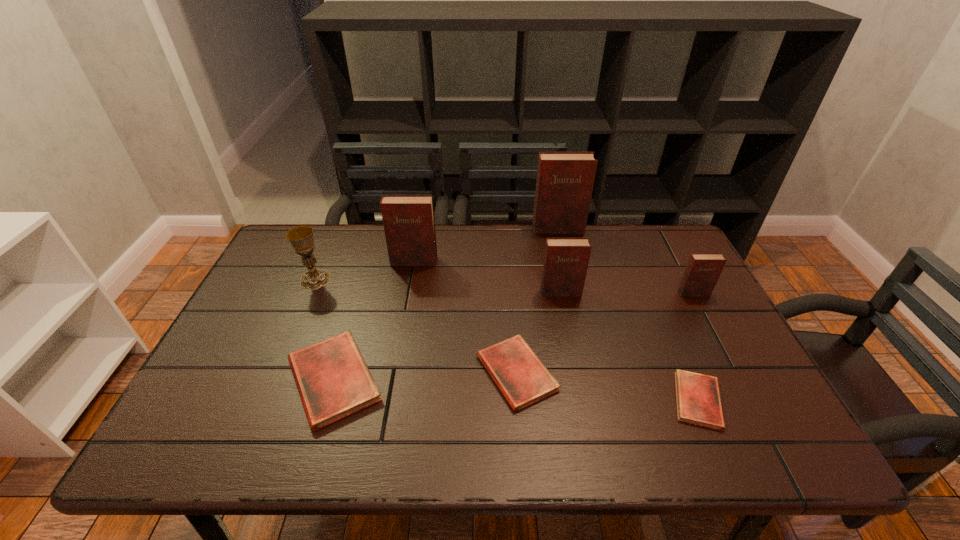
You are a GUI agent. You are given a task and a screenshot of the screen. Output one action in this format:
    pyautogui.click(x=<x>, y=<y>)
    Task: Click on the tallest diary
    The height and width of the screenshot is (540, 960).
    Given the screenshot: What is the action you would take?
    pyautogui.click(x=565, y=180)

The width and height of the screenshot is (960, 540). Find the location of `the farthest reddish-brown diary`. the farthest reddish-brown diary is located at coordinates (565, 180).

Locate an element on the screen. The image size is (960, 540). the second farthest reddish-brown diary is located at coordinates (409, 225).

At what (x,y) coordinates should I click in order to perform the action: click on the seventh nearest object. Please return your answer as a coordinate pair (x, y). The height and width of the screenshot is (540, 960). Looking at the image, I should click on (409, 225).

The image size is (960, 540). In order to click on the second smallest reddish-brown diary in this screenshot , I will do `click(565, 265)`.

I want to click on gold chalice, so click(301, 237).

Locate an element on the screen. This screenshot has width=960, height=540. the rightmost object is located at coordinates (703, 270).

Locate an element on the screen. Image resolution: width=960 pixels, height=540 pixels. the fourth shortest diary is located at coordinates click(x=703, y=270).

Where is `the leftmost red diary`? This screenshot has width=960, height=540. the leftmost red diary is located at coordinates (x=333, y=381).

Find the location of a particular element. The height and width of the screenshot is (540, 960). the third shortest object is located at coordinates (333, 381).